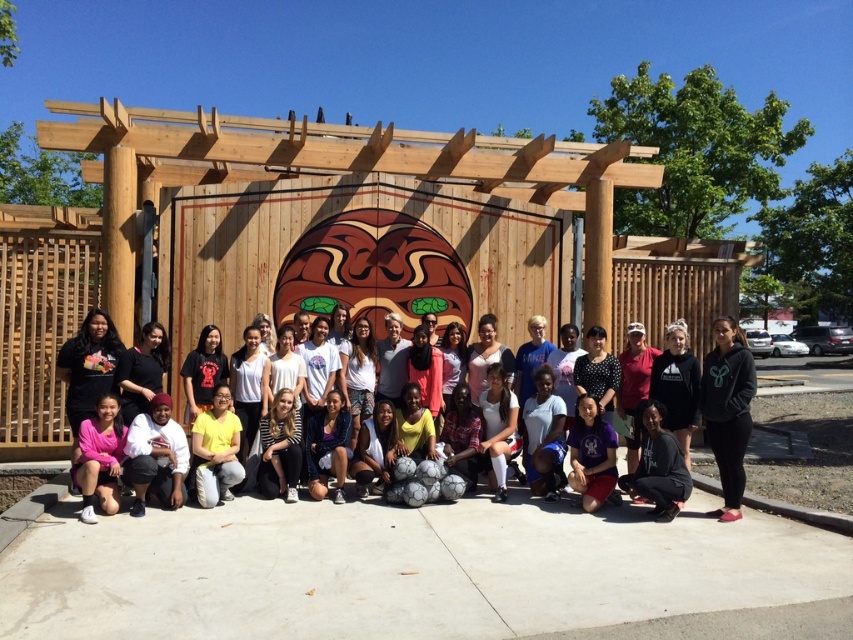
You are standing at the entrance of the pergola and want to find the matte black hoodie at center. Which direction should you look to locate it?

The matte black hoodie at center is located at coordinates 0.620 on the x axis and 0.792 on the y axis, so you should look to the right and slightly downward from the center point of the image.

Based on the photo, you are organizing a photo shoot and need to arrange two models wearing the black hoodie at lower right and the white matte shirt at center. Based on their current positions, which model should you instruct to move to the left to create symmetry between them?

The black hoodie at lower right should move to the left since it is currently positioned to the right of the white matte shirt at center, so moving it left would align them symmetrically.

You are a photographer taking a picture of the group under the pergola. You notice the black hoodie at lower right and the white matte shirt at center. Which clothing item is positioned higher in the photo?

The black hoodie at lower right is above the white matte shirt at center, so it is positioned higher in the photo.